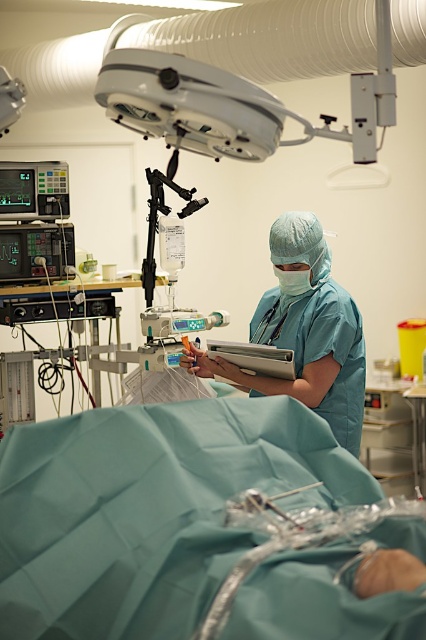
Question: Which point is farther from the camera taking this photo?

Choices:
 (A) (307, 360)
 (B) (141, 106)

Answer: (A)

Question: Which point is farther to the camera?

Choices:
 (A) (362, 104)
 (B) (313, 317)

Answer: (B)

Question: Is white plastic surgical light at upper center to the right of teal matte scrubs at center from the viewer's perspective?

Choices:
 (A) no
 (B) yes

Answer: (A)

Question: Among these objects, which one is nearest to the camera?

Choices:
 (A) white plastic surgical light at upper center
 (B) teal matte scrubs at center

Answer: (A)

Question: In this image, where is white plastic surgical light at upper center located relative to teal matte scrubs at center?

Choices:
 (A) above
 (B) below

Answer: (A)

Question: Is white plastic surgical light at upper center positioned before teal matte scrubs at center?

Choices:
 (A) no
 (B) yes

Answer: (B)